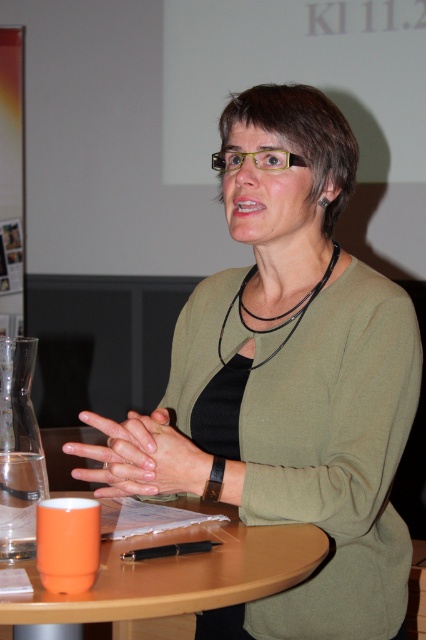
Question: Which object is closer to the camera taking this photo?

Choices:
 (A) black leather necklace at center
 (B) orange matte cup at lower left
 (C) smooth skin hands at center
 (D) matte green sweater at center

Answer: (B)

Question: Is orange matte cup at lower left thinner than black leather necklace at center?

Choices:
 (A) yes
 (B) no

Answer: (B)

Question: Estimate the real-world distances between objects in this image. Which object is closer to the black leather necklace at center?

Choices:
 (A) matte green sweater at center
 (B) smooth skin hands at center

Answer: (A)

Question: Estimate the real-world distances between objects in this image. Which object is closer to the smooth skin hands at center?

Choices:
 (A) matte green sweater at center
 (B) orange matte cup at lower left
 (C) black leather necklace at center

Answer: (B)

Question: Can you confirm if orange matte cup at lower left is positioned to the right of black leather necklace at center?

Choices:
 (A) no
 (B) yes

Answer: (A)

Question: Can you confirm if matte green sweater at center is bigger than orange matte cup at lower left?

Choices:
 (A) yes
 (B) no

Answer: (A)